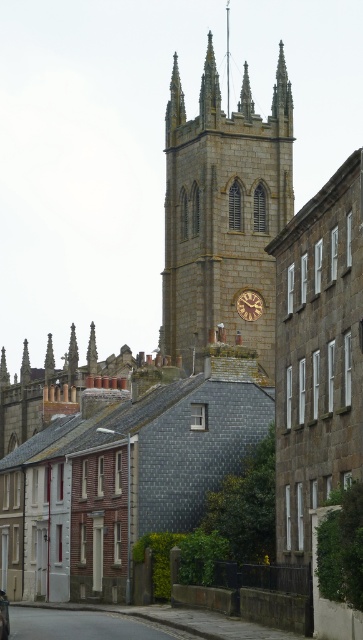
Is stone clock tower at center to the right of brown stone clock at center from the viewer's perspective?

Incorrect, stone clock tower at center is not on the right side of brown stone clock at center.

Who is lower down, stone clock tower at center or brown stone clock at center?

brown stone clock at center

I want to click on stone clock tower at center, so click(x=222, y=212).

Identify the location of stone clock tower at center. (222, 212).

Is the position of brown stone clock at center more distant than that of metallic silver car at center?

Yes, it is.

Which is below, brown stone clock at center or metallic silver car at center?

Positioned lower is metallic silver car at center.

Does point (237, 300) come closer to viewer compared to point (3, 636)?

No, (237, 300) is behind (3, 636).

I want to click on brown stone clock at center, so click(249, 305).

Consider the image. Is stone clock tower at center further to the viewer compared to metallic silver car at center?

Yes, it is behind metallic silver car at center.

Between stone clock tower at center and metallic silver car at center, which one has less height?

With less height is metallic silver car at center.

Is point (258, 284) positioned after point (2, 614)?

Yes, it is.

Locate an element on the screen. stone clock tower at center is located at coordinates (222, 212).